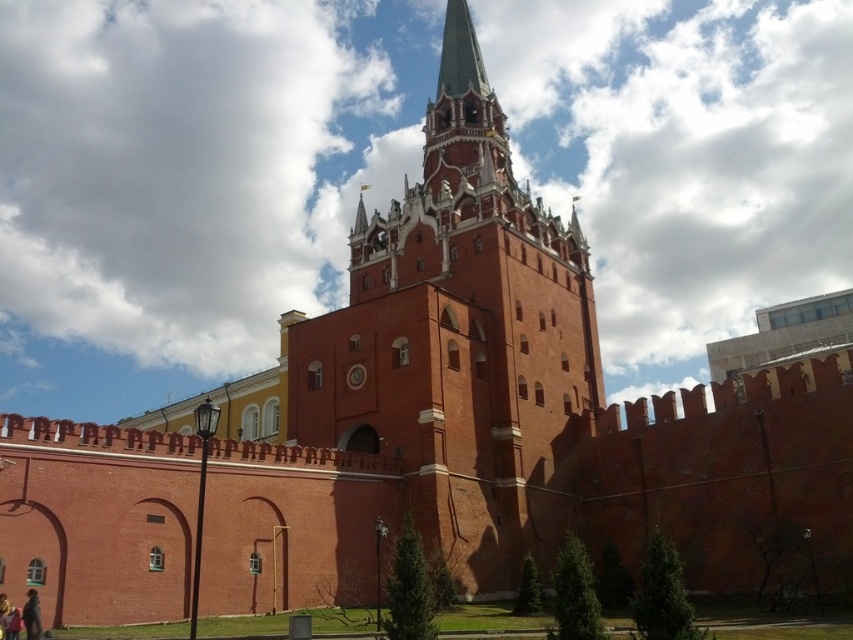
Based on the photo, is red brick tower at center behind dark brown leather jacket at lower left?

Yes, red brick tower at center is behind dark brown leather jacket at lower left.

Between point (323, 365) and point (28, 628), which one is positioned in front?

Point (28, 628) is in front.

The width and height of the screenshot is (853, 640). Identify the location of red brick tower at center. (460, 340).